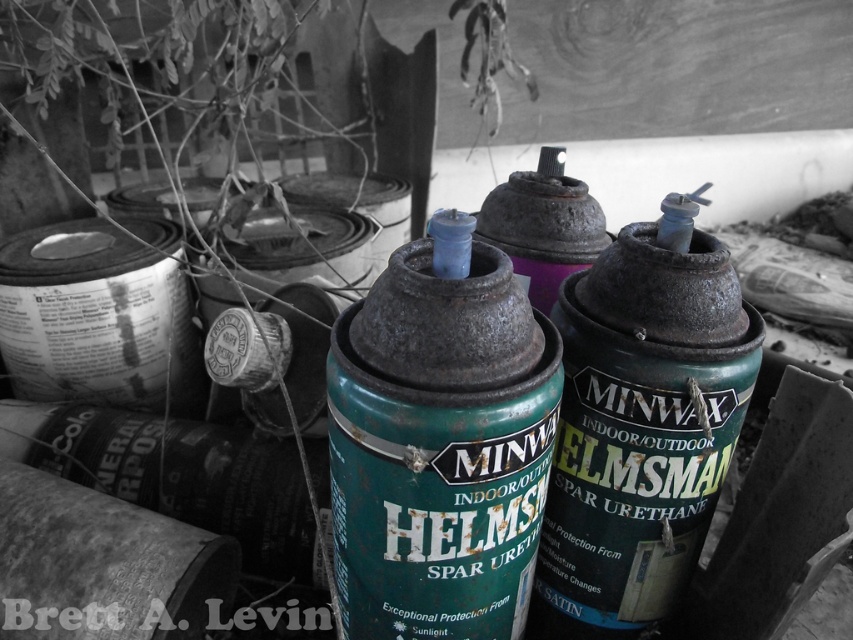
Is rusty green paint can at center in front of green matte spray can at center?

Yes.

Is rusty green paint can at center shorter than green matte spray can at center?

Yes.

Is point (384, 636) positioned behind point (700, 547)?

No, it is not.

This screenshot has width=853, height=640. Find the location of `rusty green paint can at center`. rusty green paint can at center is located at coordinates (439, 448).